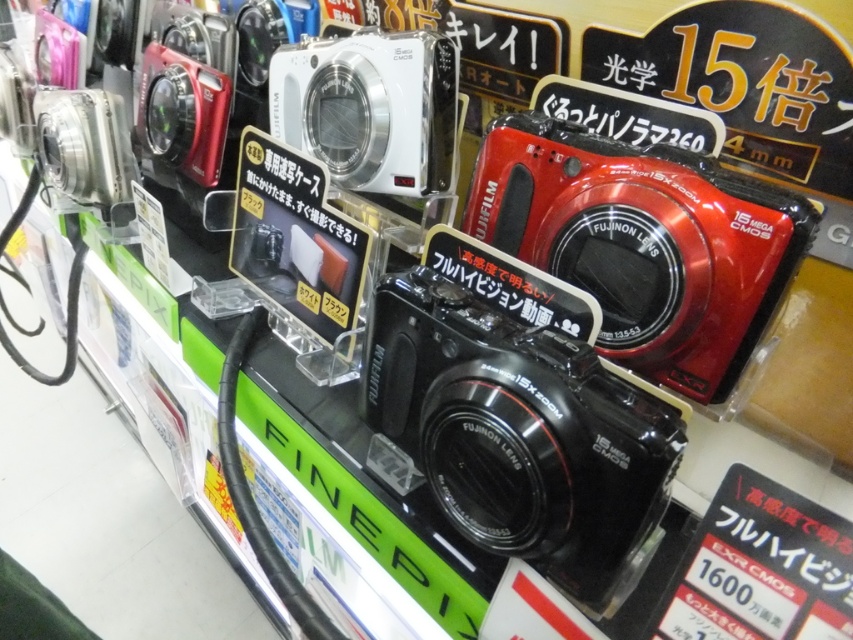
You are a customer in the store looking at the camera display. There are two points marked on the display. The first point is at coordinate point (488, 180) and the second point is at coordinate point (271, 93). Which point is closer to you?

Point (488, 180) is in front of point (271, 93), so the first point is closer to you.

You are a customer in a store looking at the camera display. You want to find the shiny red plastic camera at upper right. Where exactly is it located on the display?

The shiny red plastic camera at upper right is located at point (643,243) on the display.

You are a customer in the store and want to pick up both the black plastic camera at center and the shiny red plastic camera at upper right. How much space do you need between your hands to reach both cameras at the same time?

The black plastic camera at center is 8.43 inches away from the shiny red plastic camera at upper right, so you need at least 8.43 inches of space between your hands to reach both cameras simultaneously.